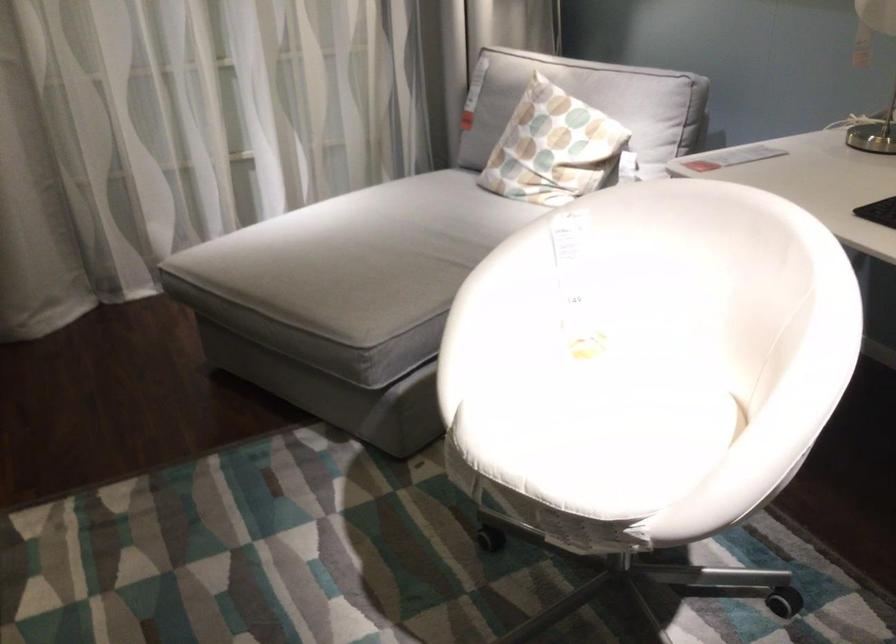
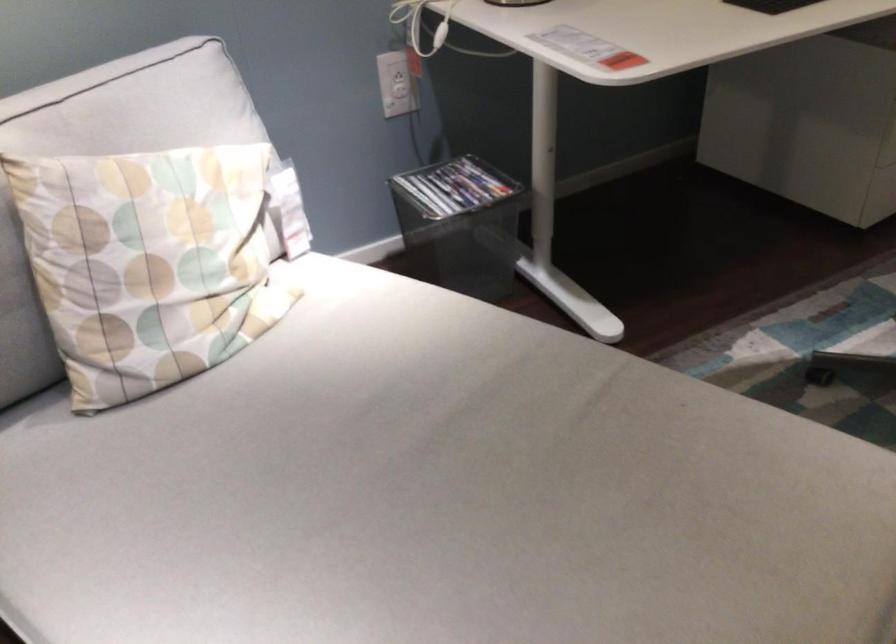
In the second image, find the point that corresponds to the point at 524,137 in the first image.

(149, 263)